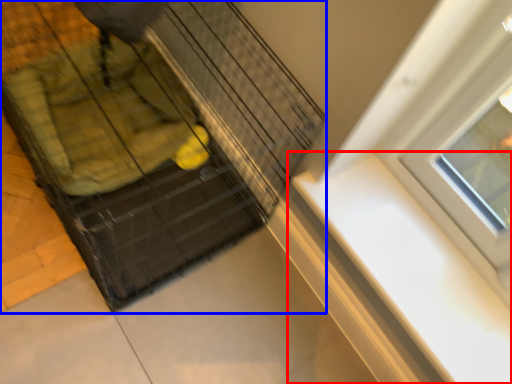
Question: Which object appears farthest to the camera in this image, window sill (highlighted by a red box) or baby carriage (highlighted by a blue box)?

Choices:
 (A) window sill
 (B) baby carriage

Answer: (A)